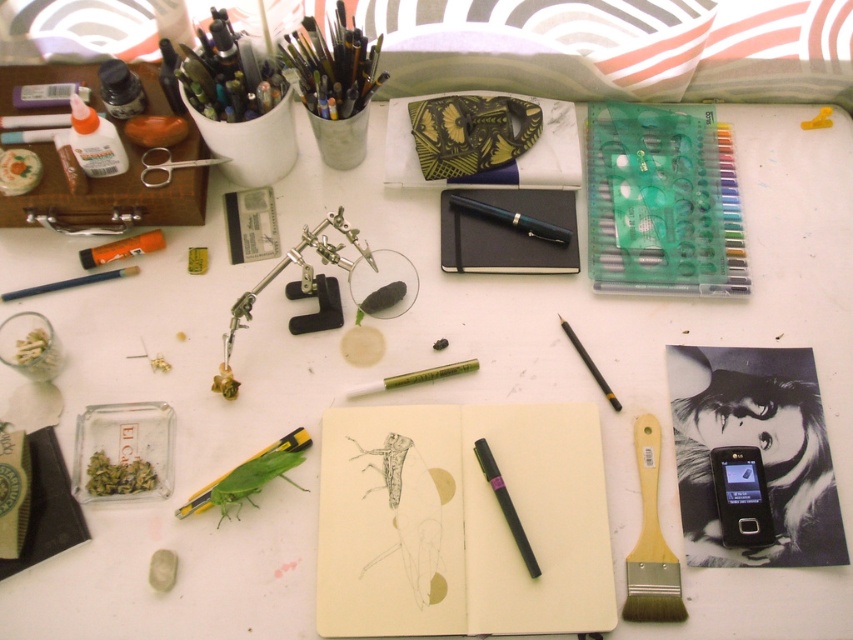
Question: Does wooden paintbrush at lower right appear under black matte pencil at center right?

Choices:
 (A) yes
 (B) no

Answer: (A)

Question: Which of the following is the farthest from the observer?

Choices:
 (A) (566, 333)
 (B) (534, 570)
 (C) (747, 289)
 (D) (73, 83)

Answer: (D)

Question: Which point is farther from the camera taking this photo?

Choices:
 (A) (599, 385)
 (B) (54, 88)

Answer: (B)

Question: Can you confirm if white paper notebook at center is positioned below matte blue pencil at left?

Choices:
 (A) no
 (B) yes

Answer: (B)

Question: In this image, where is wooden paintbrush at lower right located relative to black plastic phone at lower right?

Choices:
 (A) above
 (B) below

Answer: (B)

Question: Which point appears farthest from the camera in this image?

Choices:
 (A) (520, 554)
 (B) (540, 456)

Answer: (B)